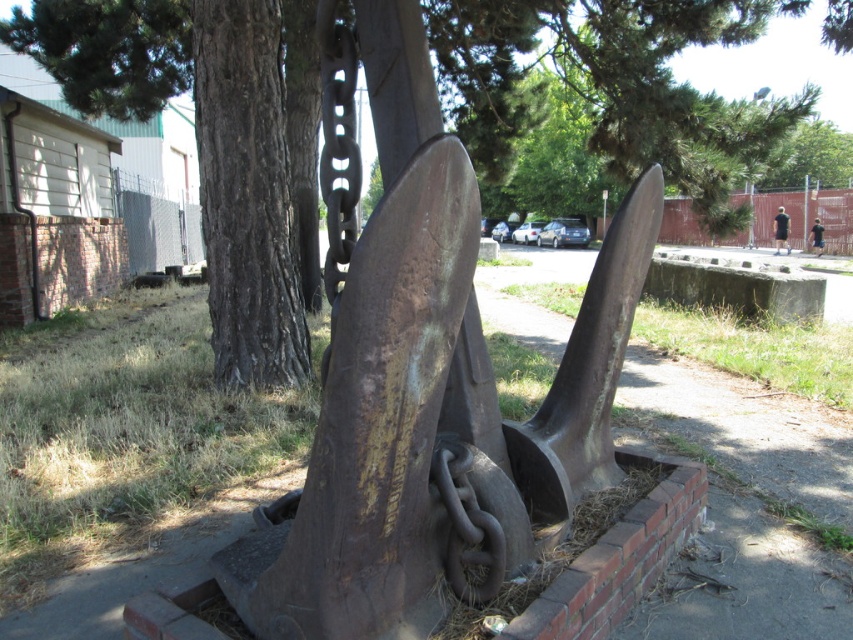
Between point (616, 483) and point (817, 172), which one is positioned in front?

Point (616, 483) is more forward.

Find the location of a particular element. rusty metal anchor at center is located at coordinates (426, 381).